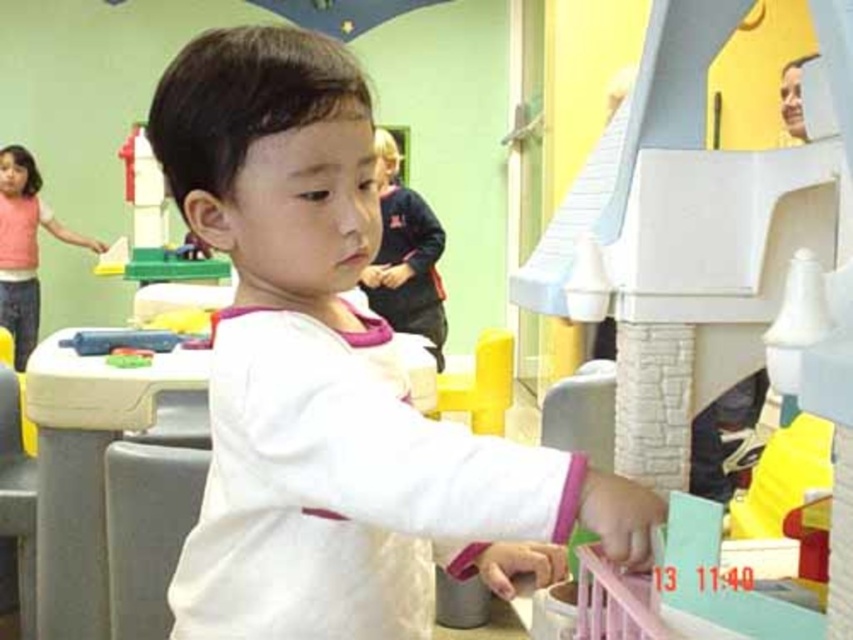
You are a teacher observing the play area. You notice the white matte shirt at center and the pink fabric shirt at upper left. Which child is closer to you?

The white matte shirt at center is closer to you because it is in front of the pink fabric shirt at upper left.

You are a photographer setting up for a group photo. You need to arrange the white matte shirt at center and the pink fabric shirt at upper left so that both are visible in the frame. Given their sizes, which shirt should you place closer to the camera to ensure they appear similar in size?

The white matte shirt at center is thinner than the pink fabric shirt at upper left, so to make them appear similar in size in the photo, place the thinner white matte shirt at center closer to the camera.